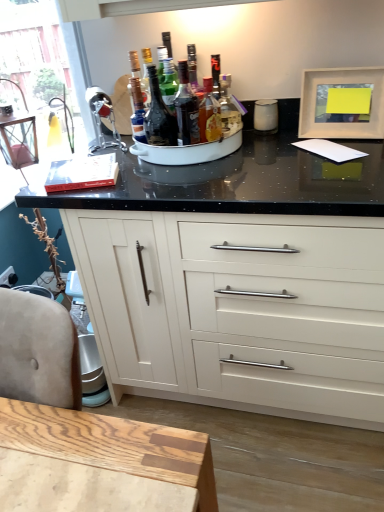
Question: Does translucent glass bottle at center, marked as the first bottle in a right-to-left arrangement, have a greater height compared to shiny dark glass bottle at center, marked as the second bottle in a left-to-right arrangement?

Choices:
 (A) yes
 (B) no

Answer: (B)

Question: From a real-world perspective, is translucent glass bottle at center, the 3th bottle in the left-to-right sequence, positioned over shiny dark glass bottle at center, marked as the second bottle in a left-to-right arrangement, based on gravity?

Choices:
 (A) yes
 (B) no

Answer: (B)

Question: Would you say translucent glass bottle at center, marked as the first bottle in a right-to-left arrangement, is outside shiny dark glass bottle at center, marked as the second bottle in a left-to-right arrangement?

Choices:
 (A) no
 (B) yes

Answer: (B)

Question: From the image's perspective, is translucent glass bottle at center, the 3th bottle in the left-to-right sequence, on top of shiny dark glass bottle at center, the second bottle positioned from the right?

Choices:
 (A) yes
 (B) no

Answer: (B)

Question: Is translucent glass bottle at center, the 3th bottle in the left-to-right sequence, positioned with its back to shiny dark glass bottle at center, marked as the second bottle in a left-to-right arrangement?

Choices:
 (A) no
 (B) yes

Answer: (A)

Question: Is translucent glass bottle at center, the 3th bottle in the left-to-right sequence, far from shiny dark glass bottle at center, the second bottle positioned from the right?

Choices:
 (A) yes
 (B) no

Answer: (B)

Question: Can you confirm if shiny dark glass bottle at center, marked as the second bottle in a left-to-right arrangement, is taller than translucent glass bottle at center, which is the 3th bottle from right to left?

Choices:
 (A) no
 (B) yes

Answer: (A)

Question: Is shiny dark glass bottle at center, the second bottle positioned from the right, shorter than translucent glass bottle at center, which is the 3th bottle from right to left?

Choices:
 (A) no
 (B) yes

Answer: (B)

Question: Is shiny dark glass bottle at center, marked as the second bottle in a left-to-right arrangement, further to camera compared to translucent glass bottle at center, which is the 3th bottle from right to left?

Choices:
 (A) yes
 (B) no

Answer: (B)

Question: Can we say shiny dark glass bottle at center, marked as the second bottle in a left-to-right arrangement, lies outside translucent glass bottle at center, which is the 3th bottle from right to left?

Choices:
 (A) yes
 (B) no

Answer: (A)

Question: Is the depth of shiny dark glass bottle at center, the second bottle positioned from the right, less than that of translucent glass bottle at center, which is the 3th bottle from right to left?

Choices:
 (A) yes
 (B) no

Answer: (A)

Question: Is shiny dark glass bottle at center, marked as the second bottle in a left-to-right arrangement, positioned with its back to translucent glass bottle at center, which is the 3th bottle from right to left?

Choices:
 (A) yes
 (B) no

Answer: (B)

Question: Is translucent glass bottle at center, which is the 1th bottle in left-to-right order, wider than shiny dark glass bottle at center, marked as the second bottle in a left-to-right arrangement?

Choices:
 (A) yes
 (B) no

Answer: (B)